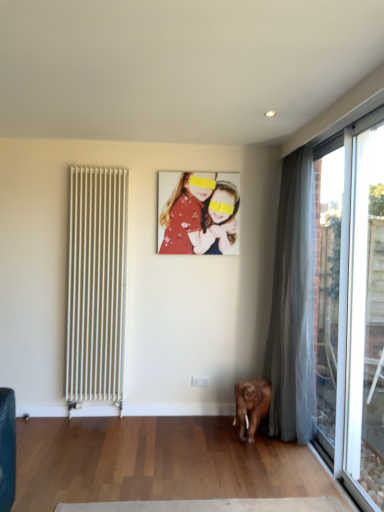
Identify the location of vacant position to the left of white metal radiator at left. (48, 423).